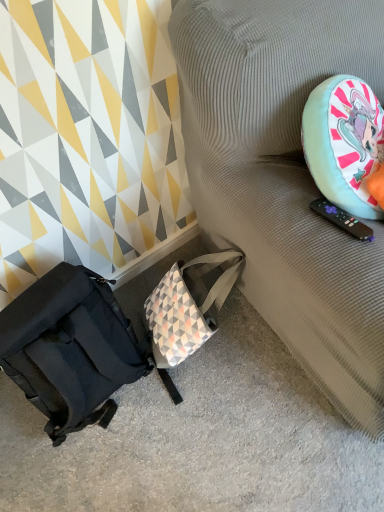
You are a GUI agent. You are given a task and a screenshot of the screen. Output one action in this format:
    pyautogui.click(x=<x>, y=<y>)
    Task: Click on the vacant area that is in front of matte black backpack at lower left
    The height and width of the screenshot is (512, 384).
    Given the screenshot: What is the action you would take?
    pyautogui.click(x=114, y=480)